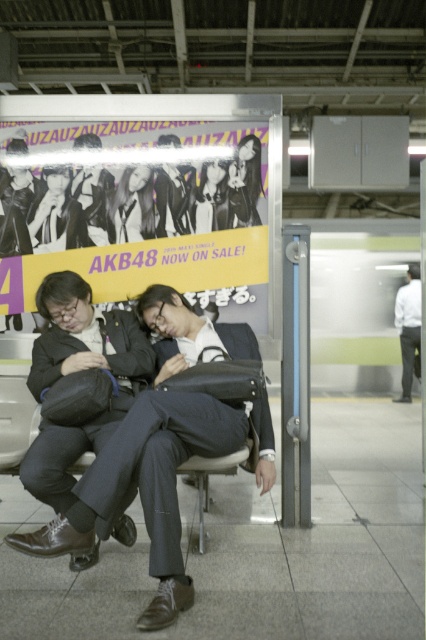
Is yellow paper poster at upper center to the left of white shirt at right from the viewer's perspective?

Yes, yellow paper poster at upper center is to the left of white shirt at right.

The height and width of the screenshot is (640, 426). Describe the element at coordinates (135, 211) in the screenshot. I see `yellow paper poster at upper center` at that location.

Where is `yellow paper poster at upper center`? yellow paper poster at upper center is located at coordinates (135, 211).

Is point (236, 212) farther from camera compared to point (215, 196)?

No, it is not.

Is smooth black hair at center wider than smooth glossy hair at upper center?

No.

Find the location of a particular element. This screenshot has height=640, width=426. smooth black hair at center is located at coordinates (244, 182).

Which is in front, point (54, 227) or point (192, 218)?

Point (192, 218)

Who is positioned more to the left, matte black jacket at upper left or smooth glossy hair at upper center?

Positioned to the left is matte black jacket at upper left.

At what (x,y) coordinates should I click in order to perform the action: click on matte black jacket at upper left. Please return your answer as a coordinate pair (x, y). Image resolution: width=426 pixels, height=640 pixels. Looking at the image, I should click on (57, 216).